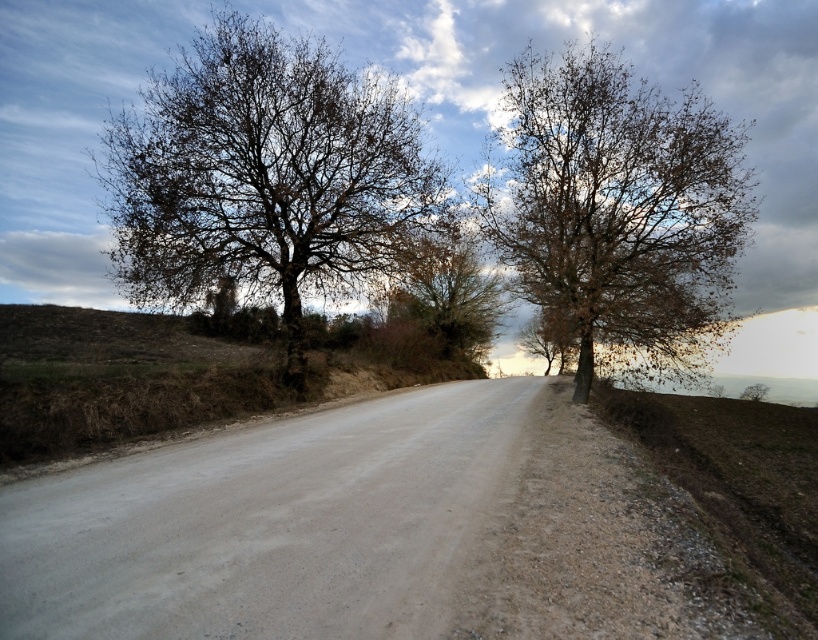
Question: Among these objects, which one is farthest from the camera?

Choices:
 (A) brown grassy hill at lower left
 (B) gray gravel road at center
 (C) brown leafy tree at center
 (D) brown leafy tree at left

Answer: (C)

Question: Does brown leafy tree at right have a lesser width compared to brown grassy hill at lower left?

Choices:
 (A) no
 (B) yes

Answer: (B)

Question: Does gray gravel road at center lie in front of brown leafy tree at left?

Choices:
 (A) no
 (B) yes

Answer: (B)

Question: Which is farther from the brown leafy tree at right?

Choices:
 (A) brown leafy tree at left
 (B) brown leafy tree at center
 (C) gray gravel road at center
 (D) brown grassy hill at lower left

Answer: (D)

Question: Which point is closer to the camera taking this photo?

Choices:
 (A) (371, 616)
 (B) (3, 362)
 (C) (133, 243)

Answer: (A)

Question: Does brown leafy tree at right appear under brown leafy tree at center?

Choices:
 (A) no
 (B) yes

Answer: (A)